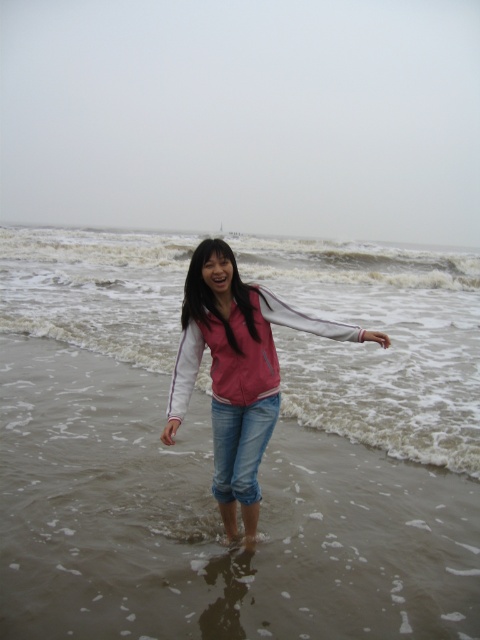
Is brown sandy water at center thinner than white frothy wave at center?

Indeed, brown sandy water at center has a lesser width compared to white frothy wave at center.

Measure the distance between point (168, 609) and camera.

The distance of point (168, 609) from camera is 10.98 feet.

What are the coordinates of `brown sandy water at center` in the screenshot? It's located at (211, 445).

Who is positioned more to the right, pink fabric jacket at center or white frothy wave at center?

Positioned to the right is white frothy wave at center.

Is point (237, 330) positioned in front of point (244, 266)?

Yes, it is in front of point (244, 266).

Which is in front, point (273, 362) or point (104, 257)?

Point (273, 362) is in front.

Find the location of `pink fabric jacket at center`. pink fabric jacket at center is located at coordinates (237, 371).

Is pink fabric jacket at center further to the viewer compared to denim jeans at center?

No.

Between pink fabric jacket at center and denim jeans at center, which one is positioned lower?

Positioned lower is denim jeans at center.

This screenshot has height=640, width=480. What do you see at coordinates (237, 371) in the screenshot?
I see `pink fabric jacket at center` at bounding box center [237, 371].

Identify the location of pink fabric jacket at center. (237, 371).